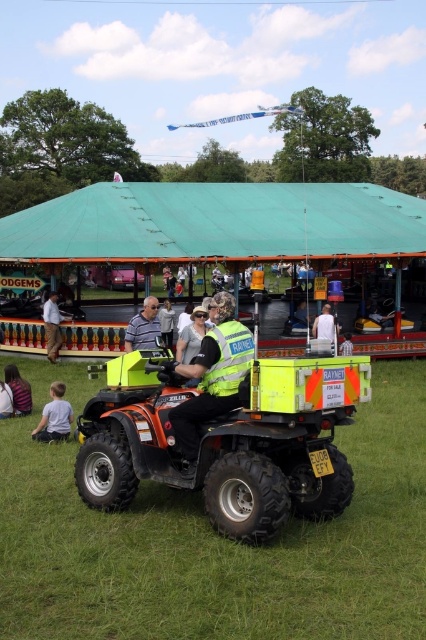
Question: Among these points, which one is nearest to the camera?

Choices:
 (A) (132, 266)
 (B) (51, 349)

Answer: (B)

Question: Does green grass at lower center appear under striped fabric shirt at lower left?

Choices:
 (A) yes
 (B) no

Answer: (A)

Question: Which point is farther from the camera taking this photo?

Choices:
 (A) (351, 352)
 (B) (112, 285)
 (C) (169, 332)

Answer: (B)

Question: Can you confirm if reflective yellow vest at center is positioned to the right of brown fabric pants at lower left?

Choices:
 (A) yes
 (B) no

Answer: (A)

Question: Which of the following is the closest to the observer?

Choices:
 (A) (55, 340)
 (B) (69, 525)
 (C) (149, 310)
 (D) (322, 321)

Answer: (B)

Question: Can you confirm if brown fabric pants at lower left is thinner than light blue shirt at center?

Choices:
 (A) yes
 (B) no

Answer: (A)